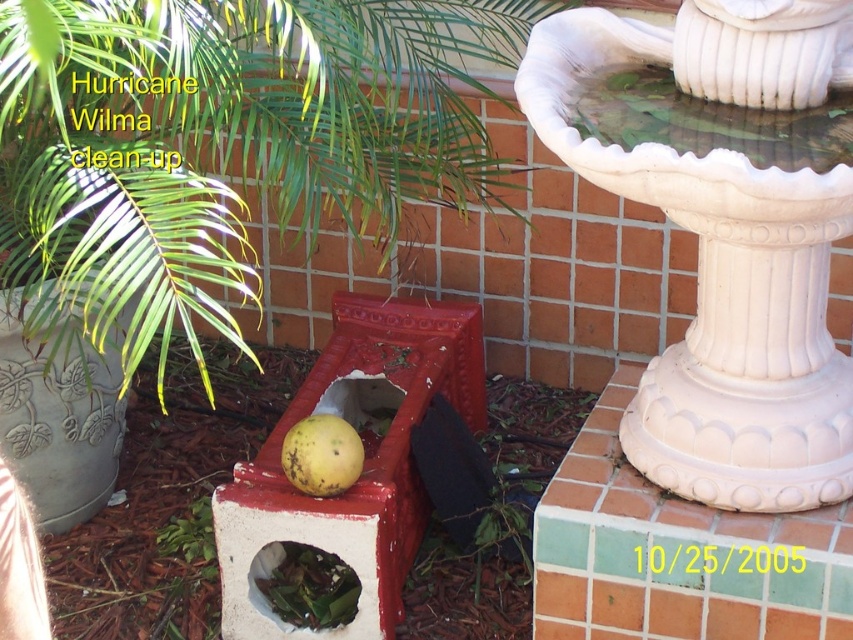
Does white ceramic fountain at upper right have a larger size compared to yellow matte fruit at center?

Yes, white ceramic fountain at upper right is bigger than yellow matte fruit at center.

In order to click on white ceramic fountain at upper right in this screenshot , I will do `click(723, 227)`.

Who is more distant from viewer, [799,477] or [311,460]?

The point [311,460] is more distant.

The height and width of the screenshot is (640, 853). What are the coordinates of `white ceramic fountain at upper right` in the screenshot? It's located at (723, 227).

Is green leafy plant at center to the right of yellow matte fruit at center from the viewer's perspective?

Incorrect, green leafy plant at center is not on the right side of yellow matte fruit at center.

Is green leafy plant at center below yellow matte fruit at center?

Actually, green leafy plant at center is above yellow matte fruit at center.

Does point (160, 308) come closer to viewer compared to point (320, 416)?

Yes, it is in front of point (320, 416).

Identify the location of green leafy plant at center. (229, 134).

Is white ceramic fountain at upper right taller than green leafy debris at center?

Yes, white ceramic fountain at upper right is taller than green leafy debris at center.

Between point (578, 115) and point (285, 618), which one is positioned behind?

The point (285, 618) is behind.

Between point (666, 163) and point (270, 589), which one is positioned behind?

Point (270, 589)

Image resolution: width=853 pixels, height=640 pixels. Identify the location of white ceramic fountain at upper right. (723, 227).